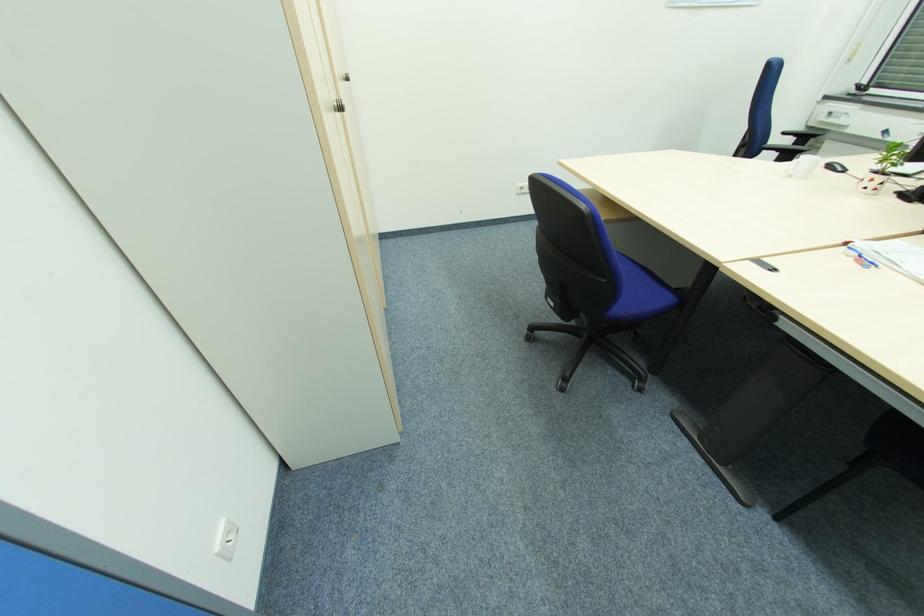
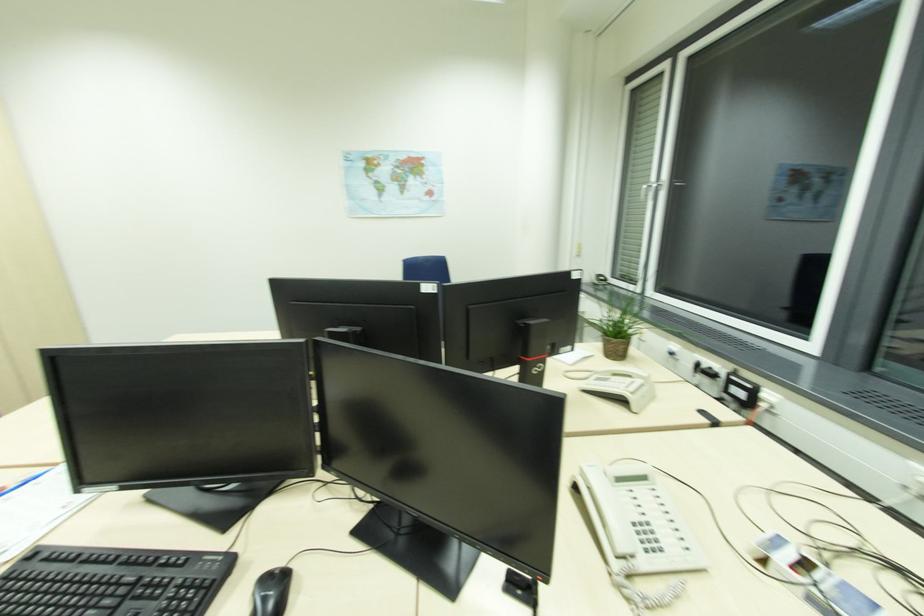
Question: The images are taken continuously from a first-person perspective. In which direction are you moving?

Choices:
 (A) Left
 (B) Right
 (C) Forward
 (D) Backward

Answer: (B)